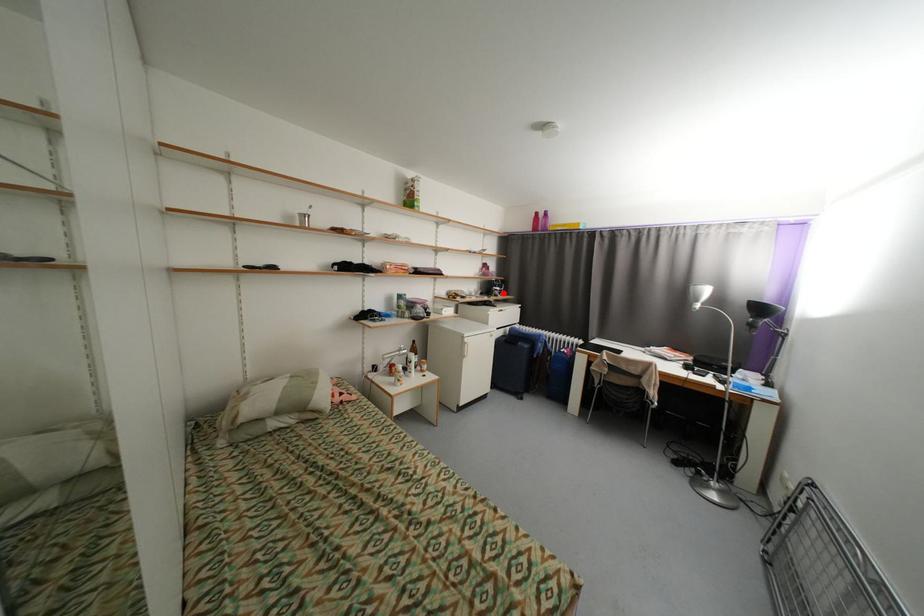
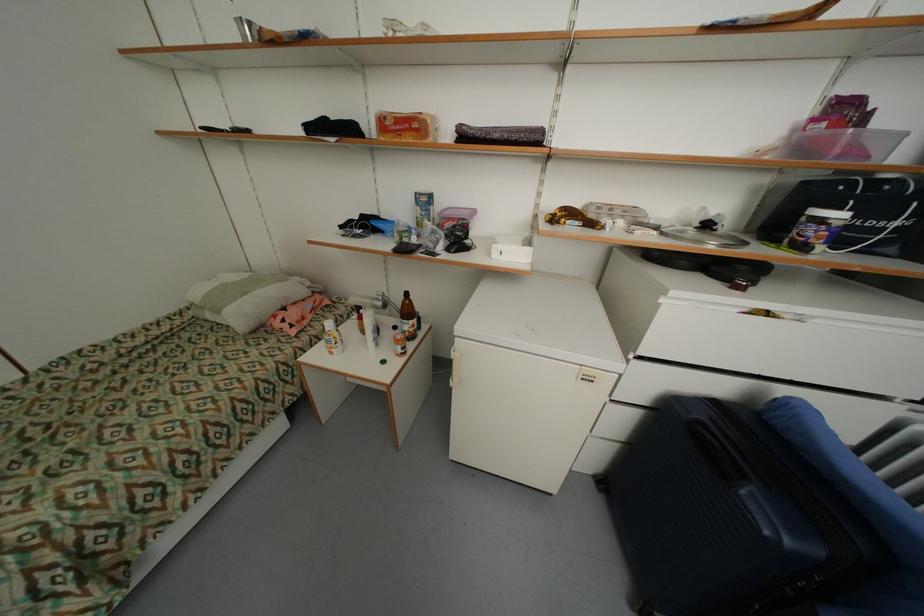
Question: A red point is marked in image1. In image2, is the corresponding 3D point closer to the camera or farther? Reply with the corresponding letter.

Choices:
 (A) The corresponding 3D point is closer.
 (B) The corresponding 3D point is farther.

Answer: (B)